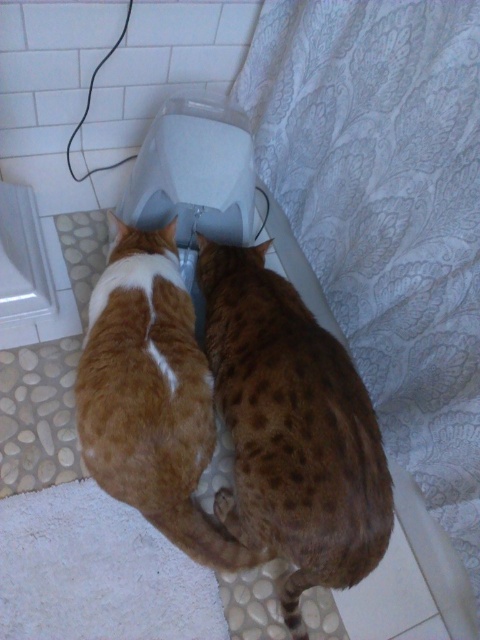
The image size is (480, 640). What do you see at coordinates (291, 429) in the screenshot? I see `spotted fur cat at center` at bounding box center [291, 429].

Can you confirm if spotted fur cat at center is positioned below orange fur cat at center?

Indeed, spotted fur cat at center is positioned under orange fur cat at center.

Describe the element at coordinates (291, 429) in the screenshot. I see `spotted fur cat at center` at that location.

You are a GUI agent. You are given a task and a screenshot of the screen. Output one action in this format:
    pyautogui.click(x=<x>, y=<y>)
    Task: Click on the spotted fur cat at center
    
    Given the screenshot: What is the action you would take?
    pyautogui.click(x=291, y=429)